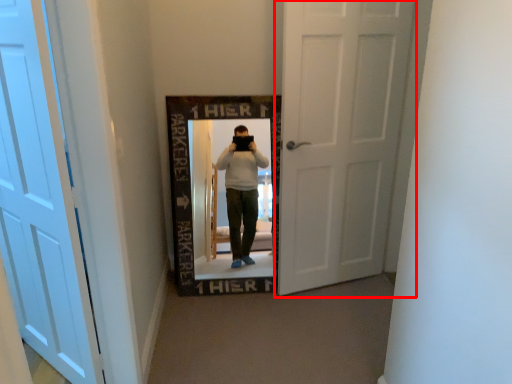
Question: Where is door (annotated by the red box) located in relation to door in the image?

Choices:
 (A) right
 (B) left

Answer: (A)